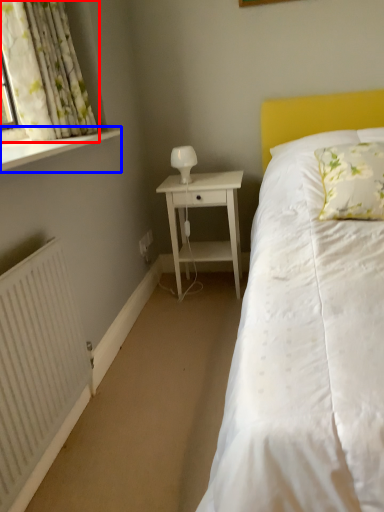
Question: Which point is further to the camera, curtain (highlighted by a red box) or window sill (highlighted by a blue box)?

Choices:
 (A) curtain
 (B) window sill

Answer: (A)